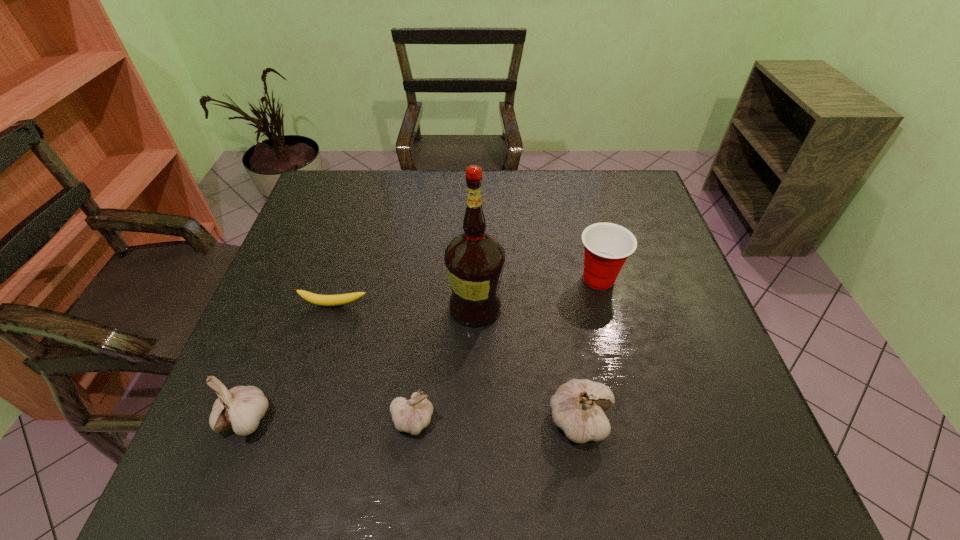
This screenshot has height=540, width=960. In order to click on vacant region between the second shortest garlic and the third object from left to right in this screenshot , I will do `click(329, 419)`.

Choose which object is the fourth nearest neighbor to the second garlic from left to right. Please provide its 2D coordinates. Your answer should be formatted as a tuple, i.e. [(x, y)], where the tuple contains the x and y coordinates of a point satisfying the conditions above.

[(341, 299)]

Locate which object is the third closest to the fourth object from right to left. Please provide its 2D coordinates. Your answer should be formatted as a tuple, i.e. [(x, y)], where the tuple contains the x and y coordinates of a point satisfying the conditions above.

[(242, 407)]

Locate which garlic is the second closest to the second garlic from right to left. Please provide its 2D coordinates. Your answer should be formatted as a tuple, i.e. [(x, y)], where the tuple contains the x and y coordinates of a point satisfying the conditions above.

[(242, 407)]

At what (x,y) coordinates should I click in order to perform the action: click on garlic that is the third closest to the banana. Please return your answer as a coordinate pair (x, y). The width and height of the screenshot is (960, 540). Looking at the image, I should click on (578, 406).

This screenshot has height=540, width=960. I want to click on vacant point that satisfies the following two spatial constraints: 1. on the back side of the tallest garlic; 2. on the label of the alcohol, so click(561, 307).